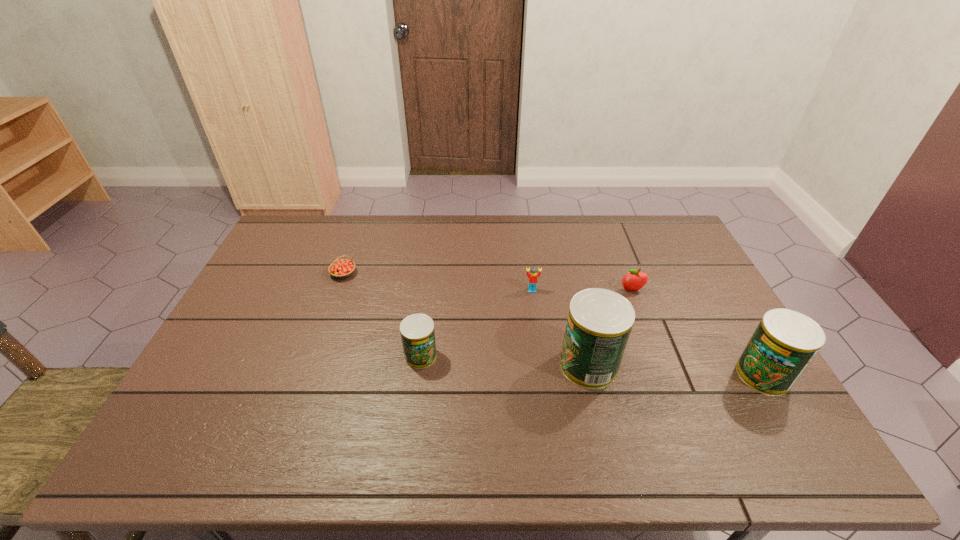
In order to click on free spot at the right edge of the desktop in this screenshot , I will do `click(697, 278)`.

Where is `vacant space at the far left corner of the desktop`? The width and height of the screenshot is (960, 540). vacant space at the far left corner of the desktop is located at coordinates (293, 230).

This screenshot has height=540, width=960. I want to click on free space at the near left corner, so click(185, 393).

This screenshot has width=960, height=540. What are the coordinates of `vacant point located between the fifth object from left to right and the third object from left to right` in the screenshot? It's located at (582, 291).

At what (x,y) coordinates should I click in order to perform the action: click on vacant point located between the apple and the third tallest object. Please return your answer as a coordinate pair (x, y). This screenshot has height=540, width=960. Looking at the image, I should click on (526, 323).

Locate an element on the screen. Image resolution: width=960 pixels, height=540 pixels. empty space between the fourth object from right to left and the apple is located at coordinates (582, 291).

You are a GUI agent. You are given a task and a screenshot of the screen. Output one action in this format:
    pyautogui.click(x=<x>, y=<y>)
    Task: Click on the vacant area that lies between the rightmost can and the second can from right to left
    This screenshot has width=960, height=540.
    Given the screenshot: What is the action you would take?
    [676, 370]

At what (x,y) coordinates should I click in order to perform the action: click on unoccupied position between the Lego and the second object from left to right. Please return your answer as a coordinate pair (x, y). The image size is (960, 540). Looking at the image, I should click on (476, 323).

Where is `free spot between the fourth shortest object and the second can from right to left`? The height and width of the screenshot is (540, 960). free spot between the fourth shortest object and the second can from right to left is located at coordinates (505, 361).

I want to click on free spot between the second can from right to left and the second object from left to right, so click(x=505, y=361).